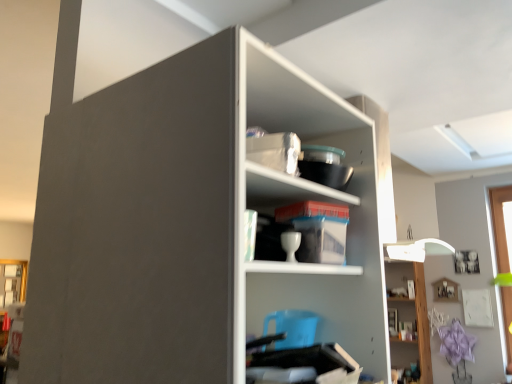
This screenshot has height=384, width=512. What do you see at coordinates (410, 318) in the screenshot?
I see `white glossy lamp at upper right, which ranks as the first shelf in bottom-to-top order` at bounding box center [410, 318].

Where is `white matte shelf at center, the 2th shelf ordered from the bottom`? Image resolution: width=512 pixels, height=384 pixels. white matte shelf at center, the 2th shelf ordered from the bottom is located at coordinates [189, 223].

This screenshot has width=512, height=384. I want to click on matte gold frame at lower left, so click(12, 282).

Based on the photo, are white glossy cabinet at upper right and matte gold frame at lower left beside each other?

There is a gap between white glossy cabinet at upper right and matte gold frame at lower left.

Can you tell me how much white glossy cabinet at upper right and matte gold frame at lower left differ in facing direction?

The angle between the facing direction of white glossy cabinet at upper right and the facing direction of matte gold frame at lower left is 95.2 degrees.

Measure the distance from white glossy cabinet at upper right to matte gold frame at lower left.

white glossy cabinet at upper right and matte gold frame at lower left are 2.82 meters apart from each other.

The height and width of the screenshot is (384, 512). What are the coordinates of `cabinet that is above the matte gold frame at lower left (from a real-world perspective)` in the screenshot? It's located at (398, 274).

Based on the photo, how many degrees apart are the facing directions of matte gold frame at lower left and white glossy cabinet at upper right?

They differ by 95.2 degrees in their facing directions.

Can you confirm if matte gold frame at lower left is thinner than white glossy cabinet at upper right?

Yes.

From the picture: From a real-world perspective, which object stands above the other?

white glossy cabinet at upper right is physically above.

Is matte gold frame at lower left to the right of white glossy cabinet at upper right from the viewer's perspective?

In fact, matte gold frame at lower left is to the left of white glossy cabinet at upper right.

From the matte gold frame at lower left, count 2nd shelfs forward and point to it. Please provide its 2D coordinates.

[(286, 190)]

Which is more to the left, white glossy cup at center, which is counted as the 2th shelf, starting from the right, or matte gold frame at lower left?

matte gold frame at lower left.

Which object is more forward, white glossy cup at center, which is the second shelf from front to back, or matte gold frame at lower left?

white glossy cup at center, which is the second shelf from front to back, is more forward.

Are white glossy cup at center, which is counted as the 2th shelf, starting from the right, and matte gold frame at lower left far apart?

Yes, white glossy cup at center, which is counted as the 2th shelf, starting from the right, and matte gold frame at lower left are located far from each other.

Between white glossy cabinet at upper right and white glossy cup at center, which is counted as the 1th shelf, starting from the top, which one has less height?

white glossy cup at center, which is counted as the 1th shelf, starting from the top, is shorter.

Between white glossy cabinet at upper right and white glossy cup at center, which ranks as the second shelf in back-to-front order, which one appears on the left side from the viewer's perspective?

white glossy cup at center, which ranks as the second shelf in back-to-front order.

From the image's perspective, is white glossy cabinet at upper right above or below white glossy cup at center, which is counted as the 1th shelf, starting from the top?

Clearly, from the image's perspective, white glossy cabinet at upper right is below white glossy cup at center, which is counted as the 1th shelf, starting from the top.

In terms of width, does white glossy cabinet at upper right look wider or thinner when compared to white glossy cup at center, which is the second shelf from front to back?

Clearly, white glossy cabinet at upper right has less width compared to white glossy cup at center, which is the second shelf from front to back.

From their relative heights in the image, would you say white glossy cabinet at upper right is taller or shorter than white matte shelf at center, the 2th shelf ordered from the bottom?

Considering their sizes, white glossy cabinet at upper right has less height than white matte shelf at center, the 2th shelf ordered from the bottom.

What's the angular difference between white glossy cabinet at upper right and white matte shelf at center, positioned as the 1th shelf in front-to-back order,'s facing directions?

The facing directions of white glossy cabinet at upper right and white matte shelf at center, positioned as the 1th shelf in front-to-back order, are 96.5 degrees apart.

Based on the photo, which is less distant, (404, 274) or (67, 186)?

Clearly, point (404, 274) is more distant from the camera than point (67, 186).

Is the depth of white glossy cabinet at upper right less than that of white matte shelf at center, which is counted as the third shelf, starting from the right?

No, white glossy cabinet at upper right is behind white matte shelf at center, which is counted as the third shelf, starting from the right.

Starting from the matte gold frame at lower left, which shelf is the 3rd one in front? Please provide its 2D coordinates.

[(189, 223)]

From a real-world perspective, is white matte shelf at center, which is counted as the third shelf, starting from the right, on matte gold frame at lower left?

Yes, from a real-world perspective, white matte shelf at center, which is counted as the third shelf, starting from the right, is on top of matte gold frame at lower left.

Is white matte shelf at center, which is counted as the third shelf, starting from the right, outside of matte gold frame at lower left?

That's correct, white matte shelf at center, which is counted as the third shelf, starting from the right, is outside of matte gold frame at lower left.

Is point (315, 194) farther from camera compared to point (398, 265)?

No, it is in front of (398, 265).

From a real-world perspective, is white glossy cup at center, which ranks as the second shelf in back-to-front order, physically located above or below white glossy cabinet at upper right?

Clearly, from a real-world perspective, white glossy cup at center, which ranks as the second shelf in back-to-front order, is above white glossy cabinet at upper right.

Can you confirm if white glossy cup at center, acting as the 3th shelf starting from the bottom, is wider than white glossy cabinet at upper right?

Yes.

Find the location of a particular element. cabinet in front of the matte gold frame at lower left is located at coordinates (398, 274).

You are a GUI agent. You are given a task and a screenshot of the screen. Output one action in this format:
    pyautogui.click(x=<x>, y=<y>)
    Task: Click on the window behind the white glossy cabinet at upper right
    The height and width of the screenshot is (384, 512).
    Given the screenshot: What is the action you would take?
    pyautogui.click(x=12, y=282)

Considering their positions, is matte gold frame at lower left positioned further to white glossy lamp at upper right, positioned as the first shelf in right-to-left order, than white glossy cup at center, acting as the 3th shelf starting from the bottom?

matte gold frame at lower left lies further to white glossy lamp at upper right, positioned as the first shelf in right-to-left order, than the other object.

Based on the photo, which object lies nearer to the anchor point white glossy lamp at upper right, marked as the third shelf in a top-to-bottom arrangement, white glossy cabinet at upper right or white glossy cup at center, acting as the 3th shelf starting from the bottom?

white glossy cabinet at upper right lies closer to white glossy lamp at upper right, marked as the third shelf in a top-to-bottom arrangement, than the other object.

Which object lies further to the anchor point white glossy cabinet at upper right, white glossy lamp at upper right, positioned as the first shelf in right-to-left order, or matte gold frame at lower left?

Answer: The object further to white glossy cabinet at upper right is matte gold frame at lower left.

Considering their positions, is matte gold frame at lower left positioned closer to white glossy cup at center, which is the second shelf from front to back, than white matte shelf at center, the first shelf when ordered from left to right?

Based on the image, white matte shelf at center, the first shelf when ordered from left to right, appears to be nearer to white glossy cup at center, which is the second shelf from front to back.

In the scene shown: Considering their positions, is white glossy lamp at upper right, the third shelf in the left-to-right sequence, positioned closer to white matte shelf at center, which is counted as the 3th shelf, starting from the back, than white glossy cup at center, which is counted as the 1th shelf, starting from the top?

white glossy cup at center, which is counted as the 1th shelf, starting from the top, lies closer to white matte shelf at center, which is counted as the 3th shelf, starting from the back, than the other object.

Which object lies nearer to the anchor point white glossy lamp at upper right, marked as the third shelf in a top-to-bottom arrangement, white matte shelf at center, the 2th shelf ordered from the bottom, or white glossy cabinet at upper right?

white glossy cabinet at upper right.

Which object lies nearer to the anchor point white matte shelf at center, which is counted as the third shelf, starting from the right, white glossy lamp at upper right, the third shelf in the left-to-right sequence, or white glossy cabinet at upper right?

white glossy cabinet at upper right.

Based on their spatial positions, is white glossy lamp at upper right, the first shelf positioned from the back, or white glossy cabinet at upper right closer to matte gold frame at lower left?

white glossy cabinet at upper right lies closer to matte gold frame at lower left than the other object.

Locate an element on the screen. The height and width of the screenshot is (384, 512). shelf between white matte shelf at center, positioned as the 1th shelf in front-to-back order, and white glossy lamp at upper right, which ranks as the first shelf in bottom-to-top order, along the z-axis is located at coordinates (286, 190).

Identify the location of cabinet between white glossy cup at center, which ranks as the second shelf in back-to-front order, and matte gold frame at lower left from front to back. (398, 274).

Find the location of `shelf between white glossy cup at center, which is counted as the 2th shelf, starting from the right, and matte gold frame at lower left in the front-back direction`. shelf between white glossy cup at center, which is counted as the 2th shelf, starting from the right, and matte gold frame at lower left in the front-back direction is located at coordinates (410, 318).

Identify the location of cabinet positioned between white matte shelf at center, the 2th shelf when ordered from top to bottom, and matte gold frame at lower left from near to far. The height and width of the screenshot is (384, 512). (x=398, y=274).